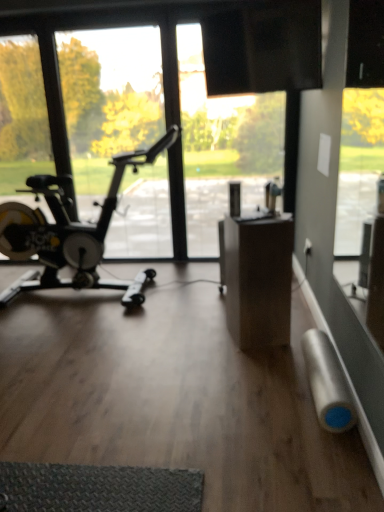
The height and width of the screenshot is (512, 384). What do you see at coordinates (327, 383) in the screenshot?
I see `silver matte duct tape at lower right` at bounding box center [327, 383].

This screenshot has height=512, width=384. Describe the element at coordinates (70, 232) in the screenshot. I see `black matte stationary bicycle at left` at that location.

Where is `transparent glass window at left`? This screenshot has height=512, width=384. transparent glass window at left is located at coordinates (109, 102).

Where is `silver matte duct tape at lower right`? The height and width of the screenshot is (512, 384). silver matte duct tape at lower right is located at coordinates (327, 383).

How different are the orientations of transparent glass window at left and black matte stationary bicycle at left in degrees?

0.000494 degrees separate the facing orientations of transparent glass window at left and black matte stationary bicycle at left.

Are transparent glass window at left and black matte stationary bicycle at left far apart?

Yes, transparent glass window at left is far from black matte stationary bicycle at left.

Is point (70, 112) positioned before point (119, 283)?

No, it is behind (119, 283).

Is transparent glass window at left bigger or smaller than black matte stationary bicycle at left?

transparent glass window at left is smaller than black matte stationary bicycle at left.

Based on the photo, is black matte stationary bicycle at left facing away from silver matte duct tape at lower right?

That's not correct — black matte stationary bicycle at left is not looking away from silver matte duct tape at lower right.

From a real-world perspective, is black matte stationary bicycle at left physically located above or below silver matte duct tape at lower right?

Clearly, from a real-world perspective, black matte stationary bicycle at left is above silver matte duct tape at lower right.

What's the angular difference between black matte stationary bicycle at left and silver matte duct tape at lower right's facing directions?

91.5 degrees separate the facing orientations of black matte stationary bicycle at left and silver matte duct tape at lower right.

Is black matte stationary bicycle at left in contact with silver matte duct tape at lower right?

No, black matte stationary bicycle at left is not with silver matte duct tape at lower right.

Is transparent glass window at left surrounded by silver matte duct tape at lower right?

No, transparent glass window at left is not surrounded by silver matte duct tape at lower right.

Is transparent glass window at left at the back of silver matte duct tape at lower right?

No.

Considering the relative positions of silver matte duct tape at lower right and transparent glass window at left in the image provided, is silver matte duct tape at lower right to the right of transparent glass window at left from the viewer's perspective?

Yes.

Are silver matte duct tape at lower right and transparent glass window at left making contact?

No, silver matte duct tape at lower right is not in contact with transparent glass window at left.

What's the angular difference between black matte stationary bicycle at left and transparent glass window at left's facing directions?

The angular difference between black matte stationary bicycle at left and transparent glass window at left is 0.000494 degrees.

Measure the distance between black matte stationary bicycle at left and transparent glass window at left.

The distance of black matte stationary bicycle at left from transparent glass window at left is 10.69 feet.

What are the coordinates of `stationary bicycle lying below the transparent glass window at left (from the image's perspective)` in the screenshot? It's located at (70, 232).

Does black matte stationary bicycle at left turn towards transparent glass window at left?

No, black matte stationary bicycle at left is not oriented towards transparent glass window at left.

From a real-world perspective, is silver matte duct tape at lower right above or below black matte stationary bicycle at left?

From a real-world perspective, silver matte duct tape at lower right is physically below black matte stationary bicycle at left.

From the picture: Is silver matte duct tape at lower right wider than black matte stationary bicycle at left?

In fact, silver matte duct tape at lower right might be narrower than black matte stationary bicycle at left.

In terms of size, does silver matte duct tape at lower right appear bigger or smaller than black matte stationary bicycle at left?

silver matte duct tape at lower right is smaller than black matte stationary bicycle at left.

From the image's perspective, is silver matte duct tape at lower right above black matte stationary bicycle at left?

Incorrect, from the image's perspective, silver matte duct tape at lower right is lower than black matte stationary bicycle at left.

At what (x,y) coordinates should I click in order to perform the action: click on duct tape on the right of transparent glass window at left. Please return your answer as a coordinate pair (x, y). The height and width of the screenshot is (512, 384). Looking at the image, I should click on (327, 383).

Between point (21, 180) and point (326, 372), which one is positioned in front?

Positioned in front is point (326, 372).

Looking at their sizes, would you say transparent glass window at left is wider or thinner than silver matte duct tape at lower right?

In the image, transparent glass window at left appears to be more narrow than silver matte duct tape at lower right.

Looking at this image, is silver matte duct tape at lower right surrounded by transparent glass window at left?

That's incorrect, silver matte duct tape at lower right is not inside transparent glass window at left.

The width and height of the screenshot is (384, 512). Identify the location of stationary bicycle on the right side of transparent glass window at left. (70, 232).

Locate an element on the screen. This screenshot has height=512, width=384. stationary bicycle on the left of silver matte duct tape at lower right is located at coordinates (70, 232).

Which object lies nearer to the anchor point transparent glass window at left, black matte stationary bicycle at left or silver matte duct tape at lower right?

black matte stationary bicycle at left is closer to transparent glass window at left.

Looking at the image, which one is located further to transparent glass window at left, silver matte duct tape at lower right or black matte stationary bicycle at left?

Based on the image, silver matte duct tape at lower right appears to be further to transparent glass window at left.

Based on their spatial positions, is transparent glass window at left or silver matte duct tape at lower right closer to black matte stationary bicycle at left?

silver matte duct tape at lower right.

Which object lies nearer to the anchor point black matte stationary bicycle at left, silver matte duct tape at lower right or transparent glass window at left?

silver matte duct tape at lower right lies closer to black matte stationary bicycle at left than the other object.

Considering their positions, is transparent glass window at left positioned closer to silver matte duct tape at lower right than black matte stationary bicycle at left?

black matte stationary bicycle at left.

Estimate the real-world distances between objects in this image. Which object is further from silver matte duct tape at lower right, black matte stationary bicycle at left or transparent glass window at left?

transparent glass window at left lies further to silver matte duct tape at lower right than the other object.

The width and height of the screenshot is (384, 512). Identify the location of stationary bicycle positioned between silver matte duct tape at lower right and transparent glass window at left from near to far. (70, 232).